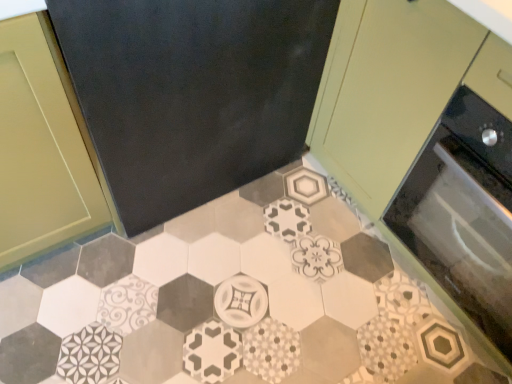
Question: Considering the positions of matte green cabinet at upper right and patterned ceramic tile at center in the image, is matte green cabinet at upper right taller or shorter than patterned ceramic tile at center?

Choices:
 (A) tall
 (B) short

Answer: (A)

Question: Based on their positions, is matte green cabinet at upper right located to the left or right of patterned ceramic tile at center?

Choices:
 (A) right
 (B) left

Answer: (A)

Question: Estimate the real-world distances between objects in this image. Which object is closer to the matte green cabinet at upper right?

Choices:
 (A) patterned ceramic tile at center
 (B) black glass oven at right

Answer: (B)

Question: Based on their relative distances, which object is nearer to the patterned ceramic tile at center?

Choices:
 (A) matte green cabinet at upper right
 (B) black glass oven at right

Answer: (B)